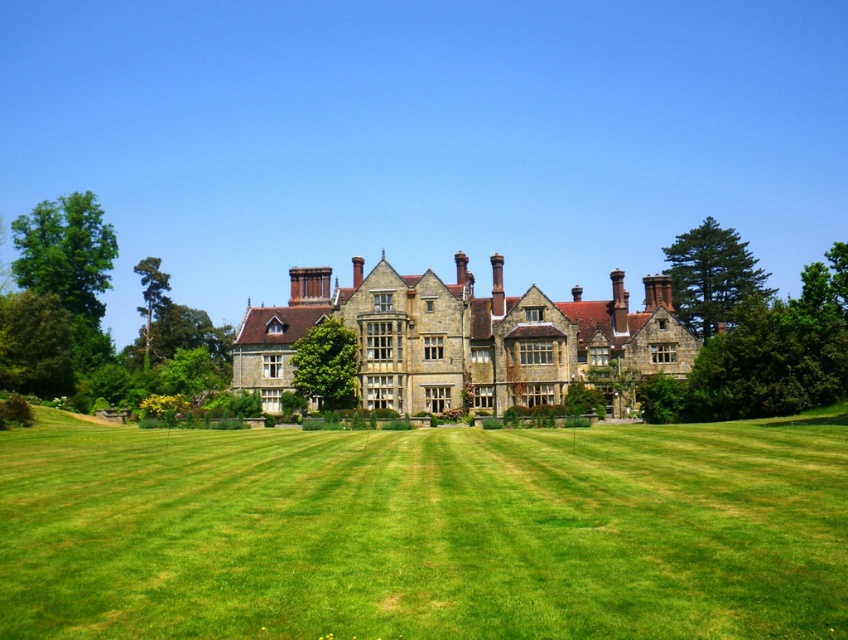
Is green grass at center wider than stone brick mansion at center?

Indeed, green grass at center has a greater width compared to stone brick mansion at center.

Find the location of a particular element. green grass at center is located at coordinates (424, 531).